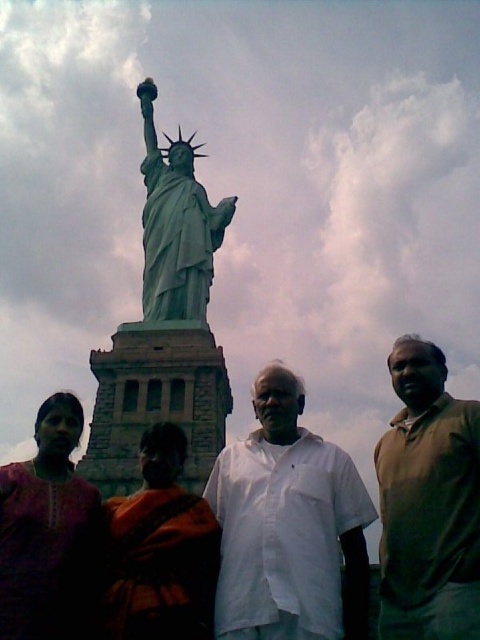
Which is in front, point (36, 522) or point (151, 106)?

Point (36, 522)

Between purple fabric at lower left and green patina statue at center, which one is positioned lower?

purple fabric at lower left is lower down.

What are the coordinates of `purple fabric at lower left` in the screenshot? It's located at (48, 531).

Between white cotton shirt at center and purple fabric at lower left, which one appears on the right side from the viewer's perspective?

From the viewer's perspective, white cotton shirt at center appears more on the right side.

Does white cotton shirt at center have a greater height compared to purple fabric at lower left?

Correct, white cotton shirt at center is much taller as purple fabric at lower left.

You are a GUI agent. You are given a task and a screenshot of the screen. Output one action in this format:
    pyautogui.click(x=<x>, y=<y>)
    Task: Click on the white cotton shirt at center
    
    Given the screenshot: What is the action you would take?
    pyautogui.click(x=288, y=525)

Can you confirm if orange fabric at center is thinner than green patina statue at center?

Yes, orange fabric at center is thinner than green patina statue at center.

Can you confirm if orange fabric at center is shorter than green patina statue at center?

Indeed, orange fabric at center has a lesser height compared to green patina statue at center.

Between point (180, 548) and point (197, 308), which one is positioned behind?

Positioned behind is point (197, 308).

The height and width of the screenshot is (640, 480). I want to click on orange fabric at center, so click(x=159, y=550).